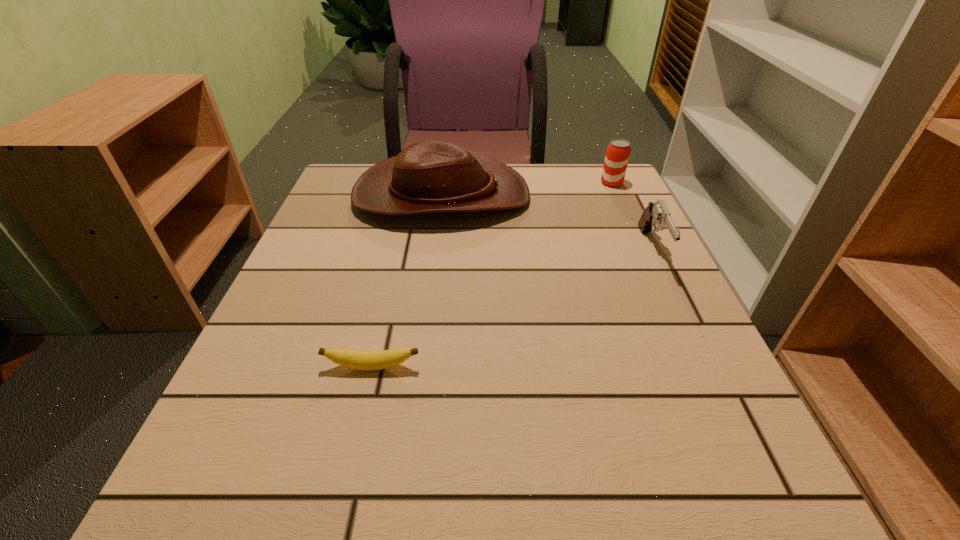
You are a GUI agent. You are given a task and a screenshot of the screen. Output one action in this format:
    pyautogui.click(x=<x>, y=<y>)
    Task: Click on the blank area at the far right corner
    The image size is (960, 540).
    Given the screenshot: What is the action you would take?
    pyautogui.click(x=585, y=175)

Where is `free space between the cowboy hat and the nearest object`? This screenshot has width=960, height=540. free space between the cowboy hat and the nearest object is located at coordinates (407, 281).

You are a GUI agent. You are given a task and a screenshot of the screen. Output one action in this format:
    pyautogui.click(x=<x>, y=<y>)
    Task: Click on the vacant space that's between the gun and the cowboy hat
    This screenshot has width=960, height=540.
    Given the screenshot: What is the action you would take?
    pyautogui.click(x=547, y=222)

In order to click on free spot between the banana and the gun in this screenshot , I will do `click(512, 308)`.

What are the coordinates of `free space between the gun and the beer can` in the screenshot? It's located at (633, 216).

The width and height of the screenshot is (960, 540). I want to click on free space between the cowboy hat and the banana, so click(x=407, y=281).

The image size is (960, 540). I want to click on free space that is in between the beer can and the shortest object, so click(492, 275).

Identify the location of vacant point located between the beer can and the gun. (633, 216).

Choose which object is the third nearest neighbor to the cowboy hat. Please provide its 2D coordinates. Your answer should be formatted as a tuple, i.e. [(x, y)], where the tuple contains the x and y coordinates of a point satisfying the conditions above.

[(358, 359)]

Locate which object ranks second in proximity to the cowboy hat. Please provide its 2D coordinates. Your answer should be formatted as a tuple, i.e. [(x, y)], where the tuple contains the x and y coordinates of a point satisfying the conditions above.

[(656, 213)]